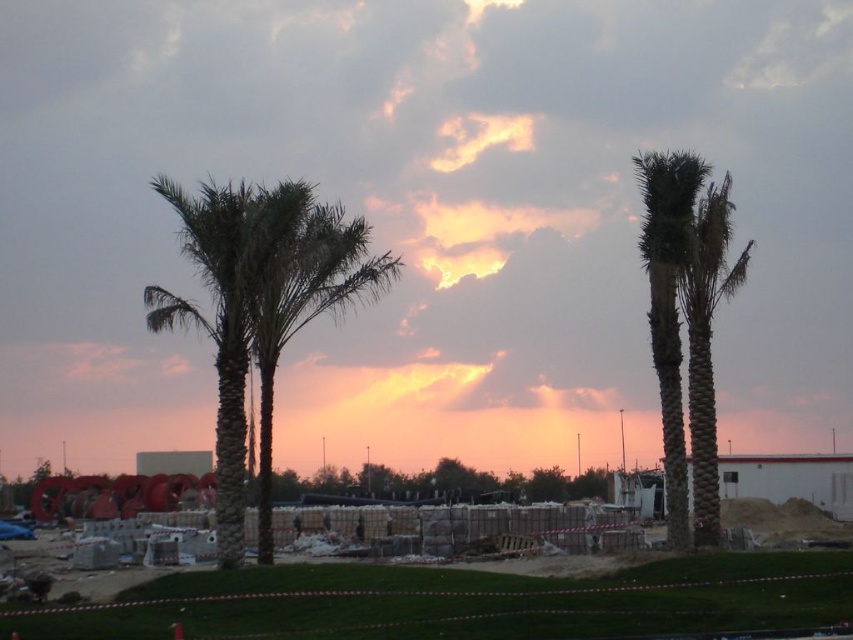
Looking at this image, can you confirm if green leafy palm at center is shorter than green textured palm tree at right?

Yes.

Based on the photo, does green leafy palm at center come behind green textured palm tree at right?

No.

At what (x,y) coordinates should I click in order to perform the action: click on green leafy palm at center. Please return your answer as a coordinate pair (x, y). The width and height of the screenshot is (853, 640). Looking at the image, I should click on (260, 307).

Is concrete blocks at center wider than green textured palm tree at right?

Indeed, concrete blocks at center has a greater width compared to green textured palm tree at right.

Between concrete blocks at center and green textured palm tree at right, which one has less height?

Standing shorter between the two is concrete blocks at center.

The height and width of the screenshot is (640, 853). Identify the location of concrete blocks at center. (463, 602).

Between concrete blocks at center and green leafy palm at center, which one has less height?

concrete blocks at center is shorter.

What do you see at coordinates (463, 602) in the screenshot? I see `concrete blocks at center` at bounding box center [463, 602].

This screenshot has width=853, height=640. Identify the location of concrete blocks at center. 463,602.